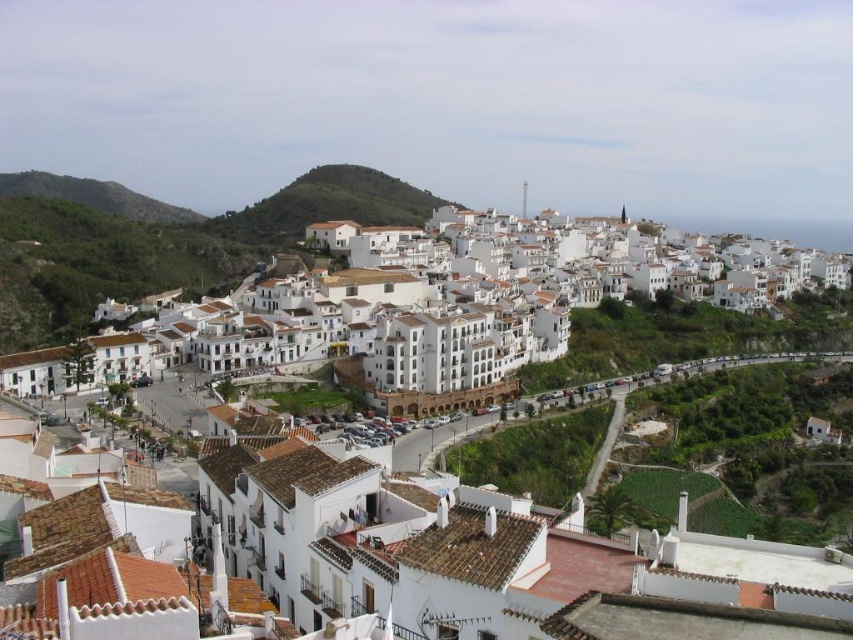
Question: Can you confirm if white matte building at center is positioned below white stucco buildings at center?

Choices:
 (A) no
 (B) yes

Answer: (B)

Question: Which object appears closest to the camera in this image?

Choices:
 (A) white matte building at center
 (B) white stucco buildings at center

Answer: (A)

Question: Is white matte building at center below white stucco buildings at center?

Choices:
 (A) yes
 (B) no

Answer: (A)

Question: From the image, what is the correct spatial relationship of white matte building at center in relation to white stucco buildings at center?

Choices:
 (A) left
 (B) right

Answer: (A)